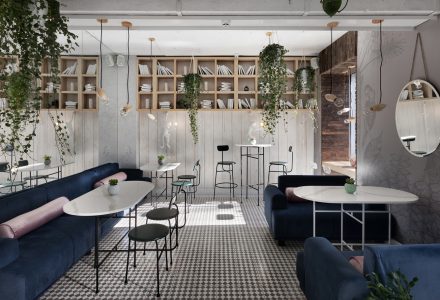
Find the location of a particular element. purple bolster pillows is located at coordinates click(x=356, y=263), click(x=294, y=191), click(x=122, y=175), click(x=35, y=213).